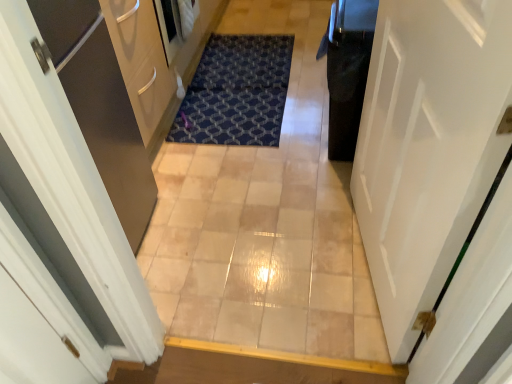
Question: Would you say black glossy trash can at right is to the left or to the right of white glossy door at right in the picture?

Choices:
 (A) right
 (B) left

Answer: (A)

Question: Is black glossy trash can at right inside the boundaries of white glossy door at right, or outside?

Choices:
 (A) inside
 (B) outside

Answer: (B)

Question: Estimate the real-world distances between objects in this image. Which object is farther from the blue textured mat at center?

Choices:
 (A) beige tile corridor at center
 (B) white glossy door at right
 (C) black glossy trash can at right

Answer: (B)

Question: Based on their relative distances, which object is farther from the beige tile corridor at center?

Choices:
 (A) blue textured mat at center
 (B) white glossy door at right
 (C) black glossy trash can at right

Answer: (B)